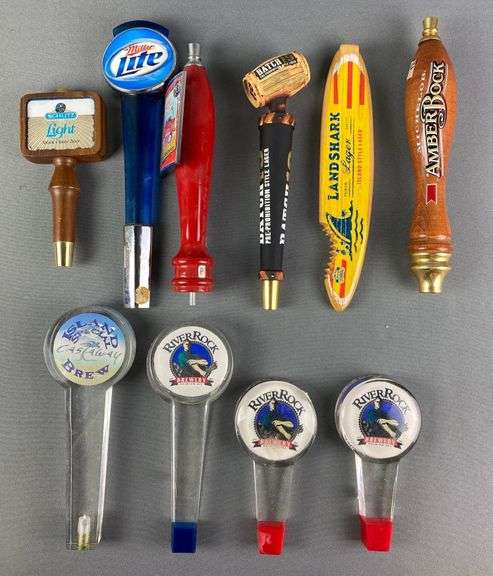
Find the location of `left side tap handles`. left side tap handles is located at coordinates (205, 439), (188, 172), (141, 151), (91, 419), (72, 137).